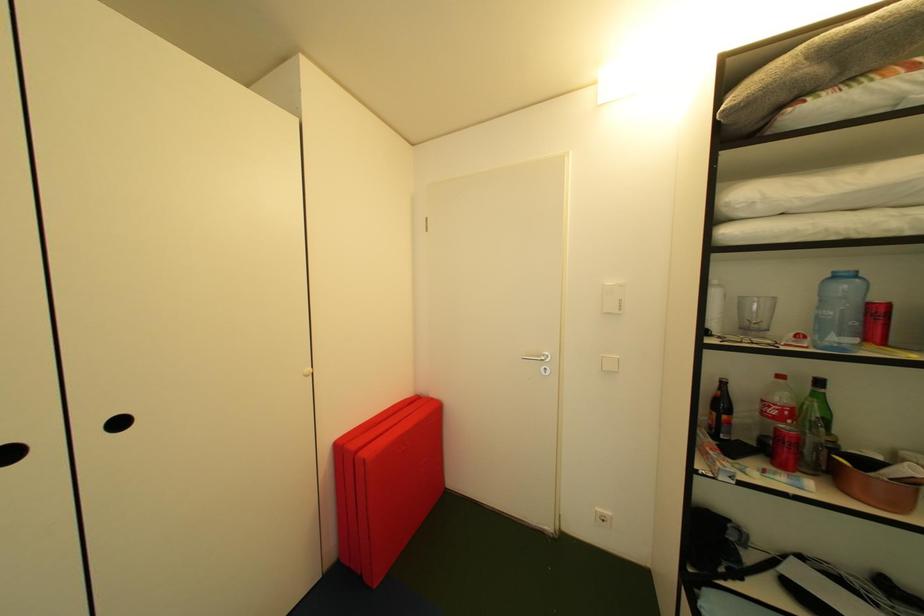
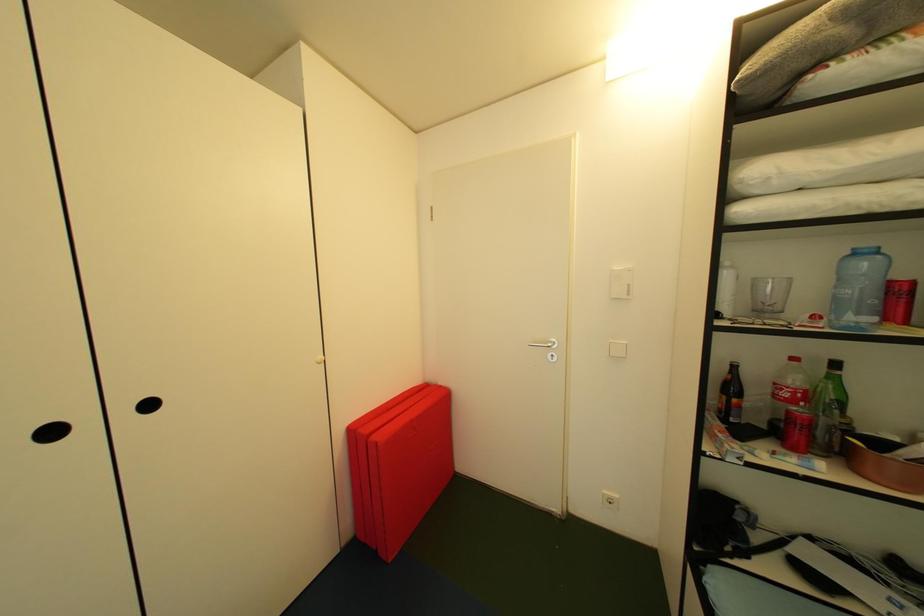
Question: The images are taken continuously from a first-person perspective. In which direction is your viewpoint rotating?

Choices:
 (A) Left
 (B) Right
 (C) Up
 (D) Down

Answer: (D)